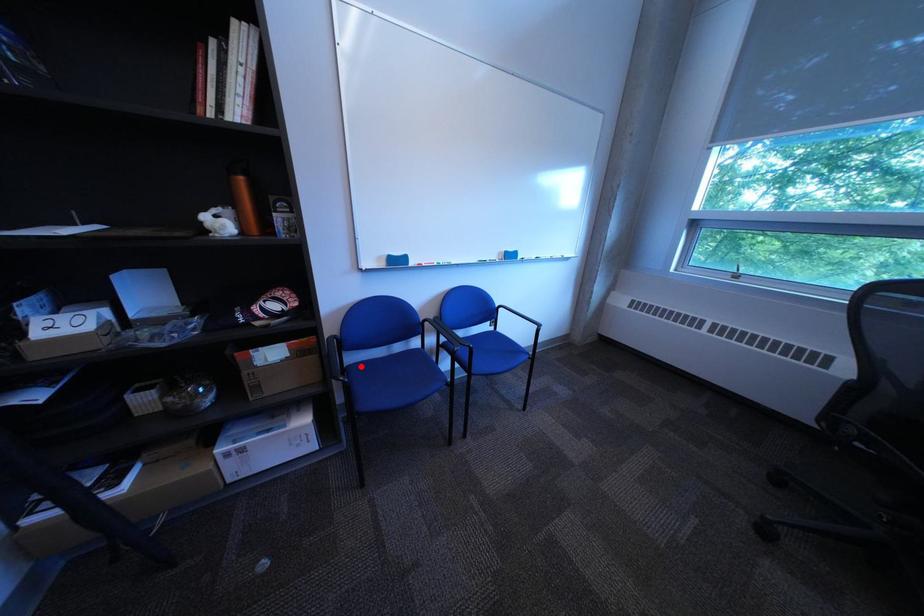
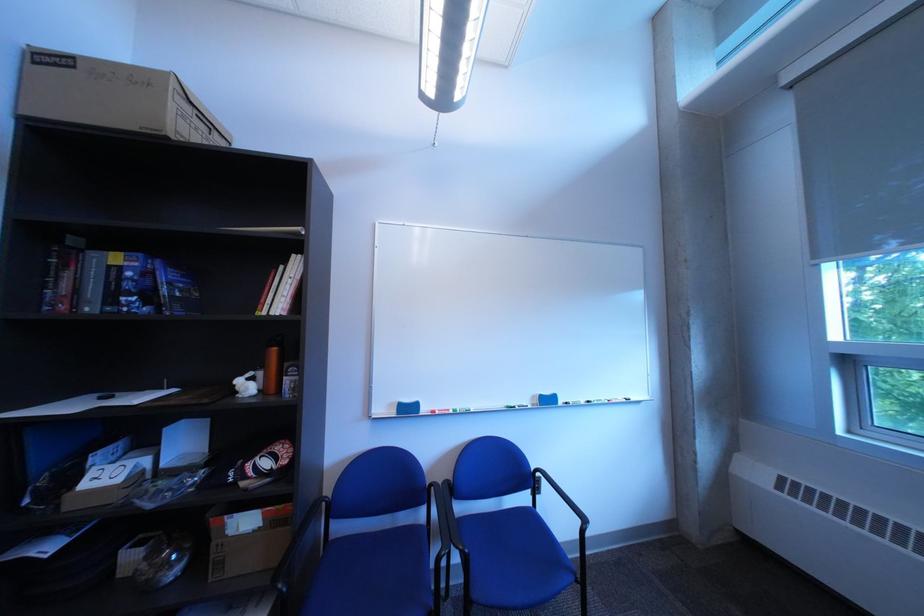
The point at the highlighted location is marked in the first image. Where is the corresponding point in the second image?

(346, 541)